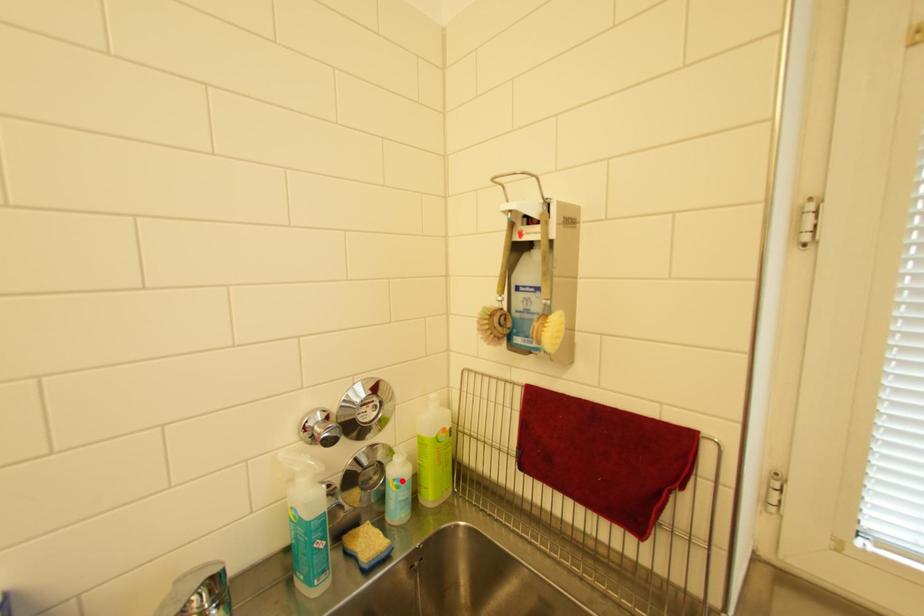
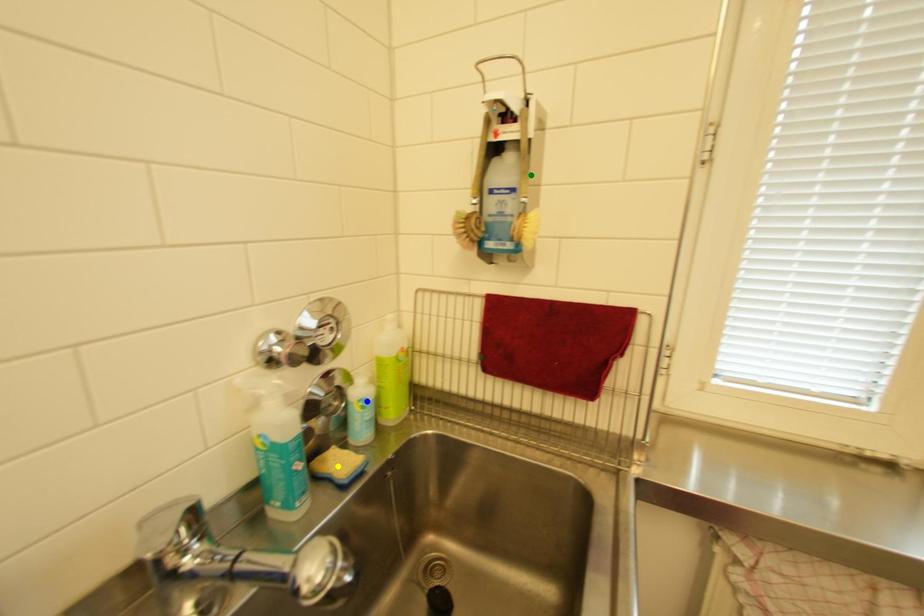
Question: I am providing you with two images of the same scene from different viewpoints. A red point is marked on the first image. You are given multiple points on the second image. Can you choose the point in image 2 that corresponds to the point in image 1?

Choices:
 (A) blue point
 (B) yellow point
 (C) green point

Answer: (A)